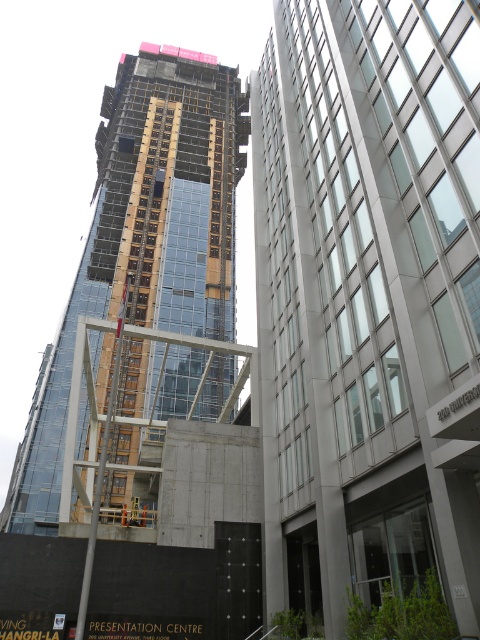
You are an architect reviewing a city plan. You notice two structures in the proposed design, the glassy concrete skyscraper at center and the glassy steel tower at center. According to the spatial arrangement, which one is positioned lower in the image?

The glassy concrete skyscraper at center is positioned lower than the glassy steel tower at center in the image.

You are standing at the point labeled point (443,316) and want to reach the entrance of the tall building under construction on the left. The entrance is located at the base of the building. Can you walk directly to the entrance without any obstacles?

The distance between you and the entrance of the tall building under construction on the left is 19.81 meters. Since there are no mentioned obstacles in the scene description, you can walk directly to the entrance.

You are a city planner reviewing the urban layout. You need to determine which of the two buildings, the glassy concrete skyscraper at center or the glassy steel tower at center, is the taller one. Based on the scene provided, which building is taller?

The glassy steel tower at center is taller than the glassy concrete skyscraper at center.